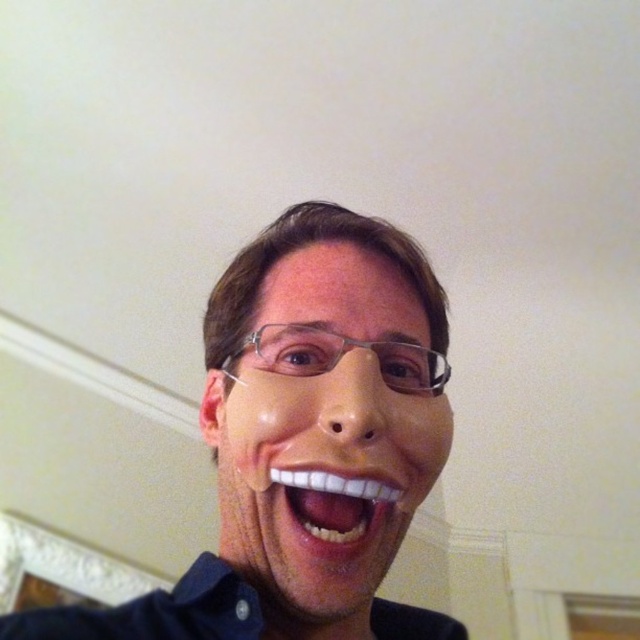
Does matte plastic mask at center have a lesser width compared to transparent plastic mask at center?

No.

Identify the location of matte plastic mask at center. This screenshot has width=640, height=640. (307, 442).

Can you confirm if matte plastic mask at center is positioned to the right of white glossy teeth at center?

Indeed, matte plastic mask at center is positioned on the right side of white glossy teeth at center.

Can you confirm if matte plastic mask at center is positioned below white glossy teeth at center?

Incorrect, matte plastic mask at center is not positioned below white glossy teeth at center.

Between point (280, 426) and point (308, 531), which one is positioned behind?

The point (308, 531) is more distant.

Identify the location of matte plastic mask at center. This screenshot has width=640, height=640. (307, 442).

Is transparent plastic mask at center to the right of white glossy teeth at center from the viewer's perspective?

Incorrect, transparent plastic mask at center is not on the right side of white glossy teeth at center.

Does transparent plastic mask at center have a greater width compared to white glossy teeth at center?

Yes, transparent plastic mask at center is wider than white glossy teeth at center.

Is point (308, 492) farther from viewer compared to point (365, 528)?

Yes, point (308, 492) is farther from viewer.

The width and height of the screenshot is (640, 640). What are the coordinates of `transparent plastic mask at center` in the screenshot? It's located at (321, 476).